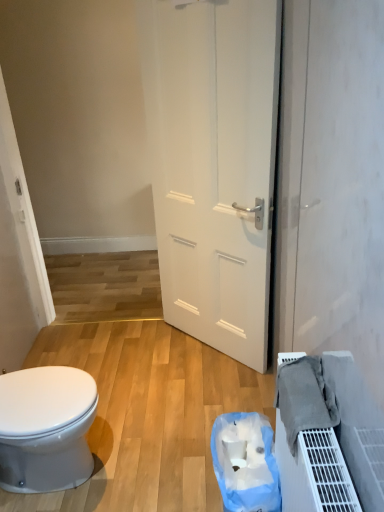
Identify the location of white glossy bidet at lower left. (45, 428).

Describe the element at coordinates (214, 164) in the screenshot. I see `white matte door at center` at that location.

Locate an element on the screen. gray fabric at lower right is located at coordinates (305, 398).

Does white matte door at center have a smaller size compared to blue plastic bag at lower center?

Actually, white matte door at center might be larger than blue plastic bag at lower center.

From a real-world perspective, is white matte door at center physically above blue plastic bag at lower center?

→ Indeed, from a real-world perspective, white matte door at center stands above blue plastic bag at lower center.

How many degrees apart are the facing directions of white matte door at center and blue plastic bag at lower center?

white matte door at center and blue plastic bag at lower center are facing 43 degrees away from each other.

Is white matte door at center inside the boundaries of white glossy bidet at lower left, or outside?

white matte door at center cannot be found inside white glossy bidet at lower left.

Is white matte door at center aimed at white glossy bidet at lower left?

Yes, white matte door at center is aimed at white glossy bidet at lower left.

Is white matte door at center far from white glossy bidet at lower left?

That's right, there is a large distance between white matte door at center and white glossy bidet at lower left.

Considering the relative positions of white matte door at center and white glossy bidet at lower left in the image provided, is white matte door at center to the left or to the right of white glossy bidet at lower left?

From the image, it's evident that white matte door at center is to the right of white glossy bidet at lower left.

From the image's perspective, is white matte door at center located above gray fabric at lower right?

Yes, from the image's perspective, white matte door at center is above gray fabric at lower right.

Can you confirm if white matte door at center is positioned to the left of gray fabric at lower right?

Indeed, white matte door at center is positioned on the left side of gray fabric at lower right.

From a real-world perspective, between white matte door at center and gray fabric at lower right, who is vertically lower?

In real-world perspective, gray fabric at lower right is lower.

From a real-world perspective, is blue plastic bag at lower center located higher than gray fabric at lower right?

Actually, blue plastic bag at lower center is physically below gray fabric at lower right in the real world.

Is blue plastic bag at lower center facing away from gray fabric at lower right?

No, gray fabric at lower right is not at the back of blue plastic bag at lower center.

Between blue plastic bag at lower center and gray fabric at lower right, which one has smaller width?

gray fabric at lower right is thinner.

From the image's perspective, does blue plastic bag at lower center appear higher than gray fabric at lower right?

No.

Between gray fabric at lower right and white glossy bidet at lower left, which one has smaller size?

gray fabric at lower right.

From a real-world perspective, is gray fabric at lower right on white glossy bidet at lower left?

Indeed, from a real-world perspective, gray fabric at lower right stands above white glossy bidet at lower left.

Is white glossy bidet at lower left inside gray fabric at lower right?

No, gray fabric at lower right does not contain white glossy bidet at lower left.

Looking at this image, considering the positions of objects white glossy bidet at lower left and gray fabric at lower right in the image provided, who is more to the left, white glossy bidet at lower left or gray fabric at lower right?

From the viewer's perspective, white glossy bidet at lower left appears more on the left side.

Which of these two, white glossy bidet at lower left or gray fabric at lower right, is bigger?

white glossy bidet at lower left is bigger.

Is white glossy bidet at lower left wider than gray fabric at lower right?

Correct, the width of white glossy bidet at lower left exceeds that of gray fabric at lower right.

Could white glossy bidet at lower left be considered to be inside blue plastic bag at lower center?

No, white glossy bidet at lower left is not surrounded by blue plastic bag at lower center.

Find the location of a particular element. This screenshot has width=384, height=512. garbage located underneath the white glossy bidet at lower left (from a real-world perspective) is located at coordinates (249, 488).

Is blue plastic bag at lower center oriented away from white glossy bidet at lower left?

No, blue plastic bag at lower center's orientation is not away from white glossy bidet at lower left.

What are the coordinates of `garbage lying on the right of white matte door at center` in the screenshot? It's located at tap(249, 488).

Identify the location of bidet located on the left of white matte door at center. This screenshot has width=384, height=512. (45, 428).

From the picture: Considering their positions, is white matte door at center positioned further to gray fabric at lower right than white glossy bidet at lower left?

Among the two, white matte door at center is located further to gray fabric at lower right.

Estimate the real-world distances between objects in this image. Which object is closer to blue plastic bag at lower center, white glossy bidet at lower left or white matte door at center?

white glossy bidet at lower left.

When comparing their distances from white matte door at center, does white glossy bidet at lower left or blue plastic bag at lower center seem further?

white glossy bidet at lower left is further to white matte door at center.

When comparing their distances from white matte door at center, does gray fabric at lower right or white glossy bidet at lower left seem closer?

gray fabric at lower right.

Estimate the real-world distances between objects in this image. Which object is further from blue plastic bag at lower center, gray fabric at lower right or white matte door at center?

Among the two, white matte door at center is located further to blue plastic bag at lower center.

Based on their spatial positions, is white matte door at center or blue plastic bag at lower center further from white glossy bidet at lower left?

Among the two, white matte door at center is located further to white glossy bidet at lower left.

When comparing their distances from white matte door at center, does gray fabric at lower right or blue plastic bag at lower center seem further?

Among the two, gray fabric at lower right is located further to white matte door at center.

Considering their positions, is blue plastic bag at lower center positioned further to white glossy bidet at lower left than white matte door at center?

white matte door at center.

Find the location of `garbage between white glossy bidet at lower left and gray fabric at lower right from left to right`. garbage between white glossy bidet at lower left and gray fabric at lower right from left to right is located at coordinates (249, 488).

At what (x,y) coordinates should I click in order to perform the action: click on material between white matte door at center and blue plastic bag at lower center in the up-down direction. Please return your answer as a coordinate pair (x, y). This screenshot has height=512, width=384. Looking at the image, I should click on pyautogui.click(x=305, y=398).

Image resolution: width=384 pixels, height=512 pixels. In order to click on bidet between white matte door at center and blue plastic bag at lower center in the up-down direction in this screenshot , I will do `click(45, 428)`.

What are the coordinates of `door between white glossy bidet at lower left and gray fabric at lower right` in the screenshot? It's located at (214, 164).